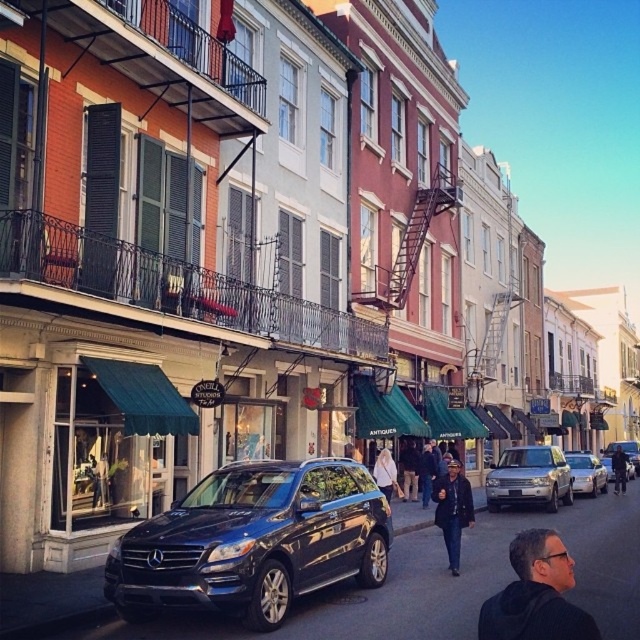
Can you confirm if shiny dark blue suv at center is positioned above dark blue jeans at center?

Yes.

Identify the location of shiny dark blue suv at center. The image size is (640, 640). (253, 541).

What do you see at coordinates (253, 541) in the screenshot? I see `shiny dark blue suv at center` at bounding box center [253, 541].

Where is `shiny dark blue suv at center`? shiny dark blue suv at center is located at coordinates (253, 541).

Is metallic silver suv at center to the right of shiny silver suv at center from the viewer's perspective?

No, metallic silver suv at center is not to the right of shiny silver suv at center.

Between metallic silver suv at center and shiny silver suv at center, which one appears on the right side from the viewer's perspective?

From the viewer's perspective, shiny silver suv at center appears more on the right side.

Which is in front, point (577, 472) or point (632, 452)?

Positioned in front is point (577, 472).

Find the location of `metallic silver suv at center`. metallic silver suv at center is located at coordinates (586, 474).